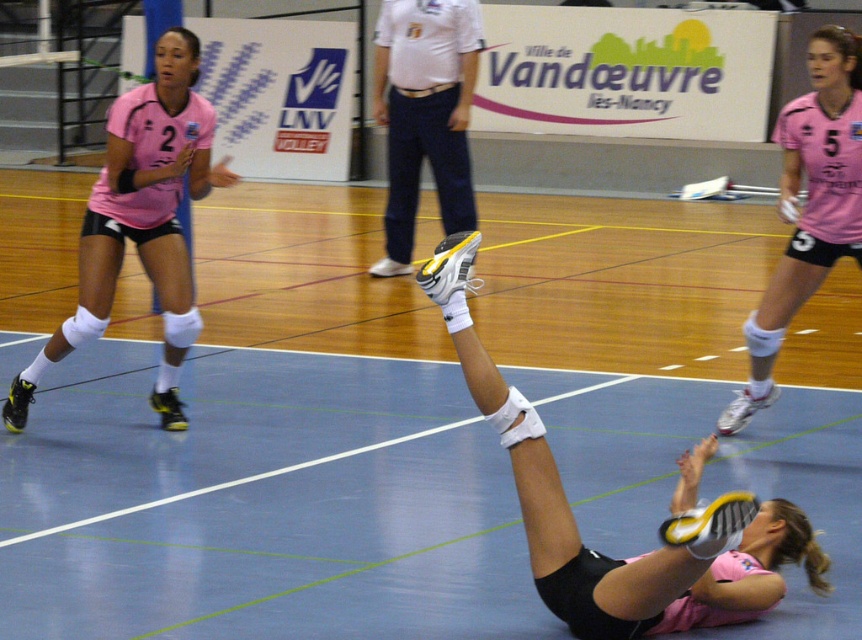
Consider the image. Does pink matte jersey at left appear on the left side of white leather shoe at center?

Correct, you'll find pink matte jersey at left to the left of white leather shoe at center.

Can you confirm if pink matte jersey at left is positioned above white leather shoe at center?

No, pink matte jersey at left is not above white leather shoe at center.

Where is `pink matte jersey at left`? This screenshot has width=862, height=640. pink matte jersey at left is located at coordinates (141, 221).

Between point (853, 80) and point (445, 120), which one is positioned behind?

Positioned behind is point (445, 120).

Between pink jersey at upper right and white leather shoe at center, which one appears on the left side from the viewer's perspective?

white leather shoe at center

Locate an element on the screen. This screenshot has width=862, height=640. pink jersey at upper right is located at coordinates (809, 205).

The image size is (862, 640). What do you see at coordinates (659, 525) in the screenshot?
I see `matte pink shorts at lower right` at bounding box center [659, 525].

Is point (759, 529) closer to camera compared to point (782, 205)?

Yes, it is in front of point (782, 205).

The image size is (862, 640). In order to click on matte pink shorts at lower right in this screenshot , I will do coord(659,525).